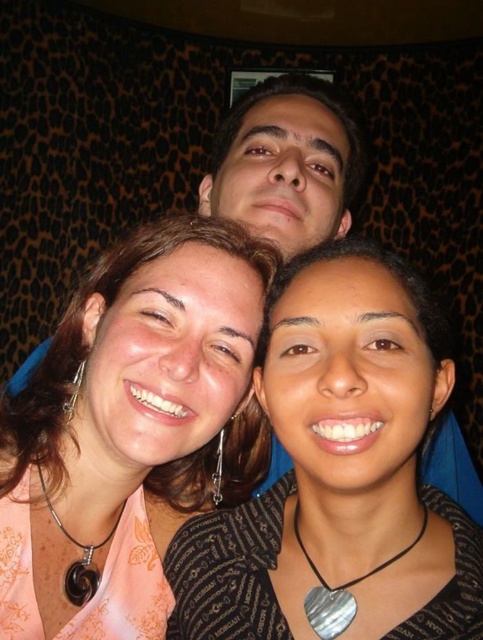
Based on the scene description, where is the black fabric at center located?

The black fabric at center is located at point (340, 472).

You are a photographer trying to adjust the focus of your camera. You notice two black items in the scene that might cause confusion. Which one of the two black items, the matte black necklace at center or the black fabric at center, is positioned higher up in the image?

The matte black necklace at center is taller than the black fabric at center, so the matte black necklace at center is positioned higher up in the image.